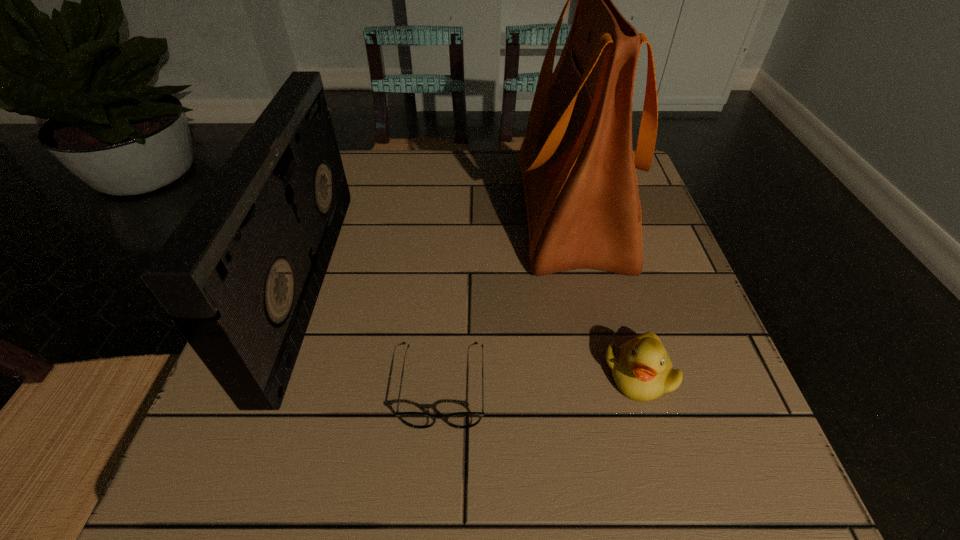
Locate an element on the screen. vacant region at the near edge of the desktop is located at coordinates (433, 458).

In order to click on vacant space at the left edge in this screenshot , I will do `click(348, 306)`.

At what (x,y) coordinates should I click in order to perform the action: click on vacant area at the right edge. Please return your answer as a coordinate pair (x, y). Looking at the image, I should click on (697, 364).

Where is `free space between the duckling and the third object from right to left`? The width and height of the screenshot is (960, 540). free space between the duckling and the third object from right to left is located at coordinates (541, 380).

At what (x,y) coordinates should I click in order to perform the action: click on vacant area that lies between the third shortest object and the duckling. Please return your answer as a coordinate pair (x, y). This screenshot has height=540, width=960. Looking at the image, I should click on (473, 328).

The height and width of the screenshot is (540, 960). I want to click on unoccupied area between the third tallest object and the third shortest object, so click(473, 328).

Find the location of a particular element. free space between the leftmost object and the duckling is located at coordinates (473, 328).

Where is `unoccupied area between the tallest object and the shortest object`? unoccupied area between the tallest object and the shortest object is located at coordinates click(x=507, y=299).

Find the location of a particular element. The image size is (960, 540). unoccupied area between the shopping bag and the spectacles is located at coordinates click(x=507, y=299).

At what (x,y) coordinates should I click in order to perform the action: click on vacant space that is in between the shopping bag and the second object from left to right. Please return your answer as a coordinate pair (x, y). Looking at the image, I should click on (507, 299).